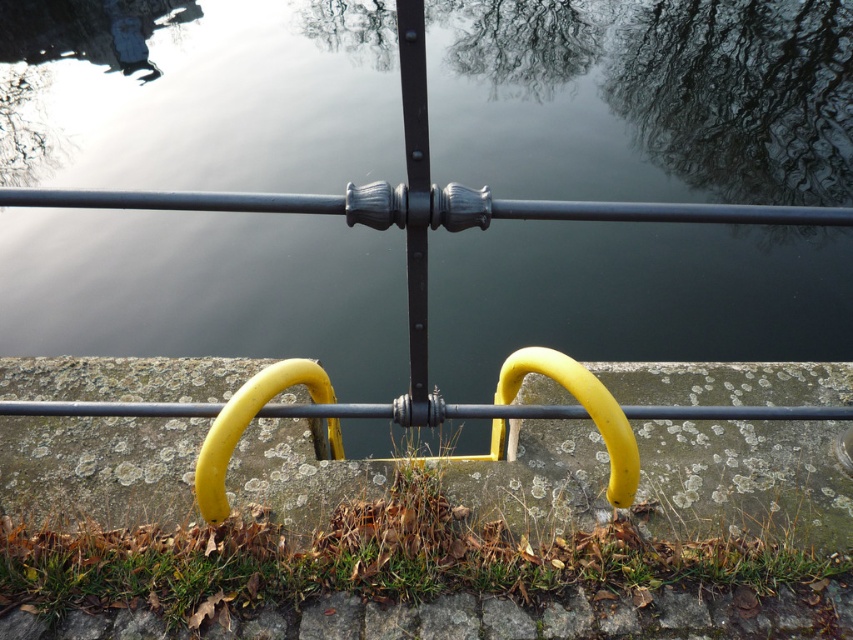
Question: Is glossy dark water at center above green grass at lower center?

Choices:
 (A) yes
 (B) no

Answer: (A)

Question: Is glossy dark water at center further to the viewer compared to green grass at lower center?

Choices:
 (A) yes
 (B) no

Answer: (A)

Question: Which point appears closest to the camera in this image?

Choices:
 (A) click(149, 131)
 (B) click(630, 604)

Answer: (B)

Question: Among these points, which one is nearest to the camera?

Choices:
 (A) (163, 588)
 (B) (749, 38)

Answer: (A)

Question: Which point is closer to the camera?

Choices:
 (A) green grass at lower center
 (B) glossy dark water at center

Answer: (A)

Question: Is the position of glossy dark water at center more distant than that of green grass at lower center?

Choices:
 (A) yes
 (B) no

Answer: (A)